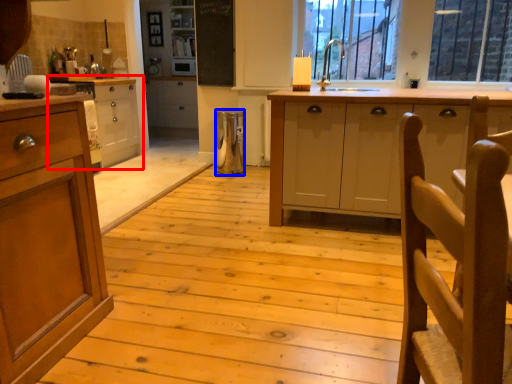
Question: Which of the following is the closest to the observer, cabinetry (highlighted by a red box) or appliance (highlighted by a blue box)?

Choices:
 (A) cabinetry
 (B) appliance

Answer: (A)